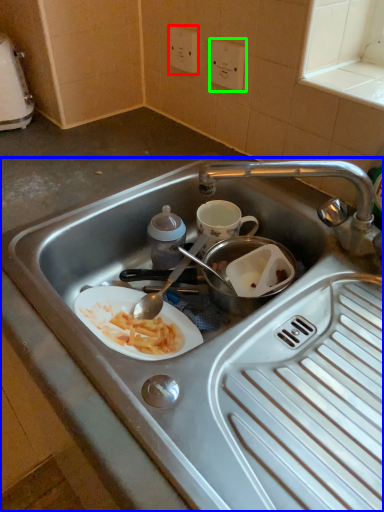
Question: Considering the real-world distances, which object is closest to electric outlet (highlighted by a red box)? sink (highlighted by a blue box) or electric outlet (highlighted by a green box).

Choices:
 (A) sink
 (B) electric outlet

Answer: (B)